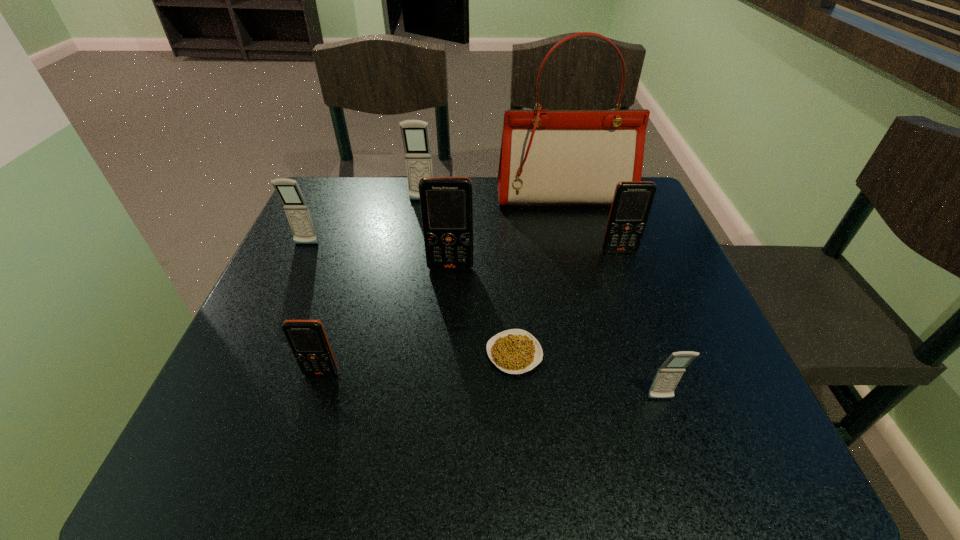
Identify the location of the nearest orange cellular telephone. (307, 339).

This screenshot has width=960, height=540. Identify the location of the second object from left to right. (307, 339).

You are a GUI agent. You are given a task and a screenshot of the screen. Output one action in this format:
    pyautogui.click(x=<x>, y=<y>)
    Task: Click on the nearest gray cellular telephone
    
    Given the screenshot: What is the action you would take?
    pyautogui.click(x=669, y=374)

This screenshot has height=540, width=960. Find the location of `the nearest cellular telephone`. the nearest cellular telephone is located at coordinates (669, 374).

At what (x,y) coordinates should I click in order to perform the action: click on the shortest object. Please return your answer as a coordinate pair (x, y). The height and width of the screenshot is (540, 960). Looking at the image, I should click on (515, 351).

The height and width of the screenshot is (540, 960). In order to click on vacant point located on the front of the tallest object in this screenshot , I will do `click(594, 314)`.

The image size is (960, 540). In order to click on vacant space located 0.080m on the front-facing side of the fourth cellular telephone from right to left in this screenshot , I will do `click(419, 222)`.

Identify the location of vacant space situated on the screen of the fifth object from right to left. The image size is (960, 540). (445, 345).

Find the location of a particular element. The width and height of the screenshot is (960, 540). free space located 0.330m on the front-facing side of the third farthest object is located at coordinates (252, 366).

Identify the location of free space located 0.370m on the screen of the rightmost orange cellular telephone. (672, 397).